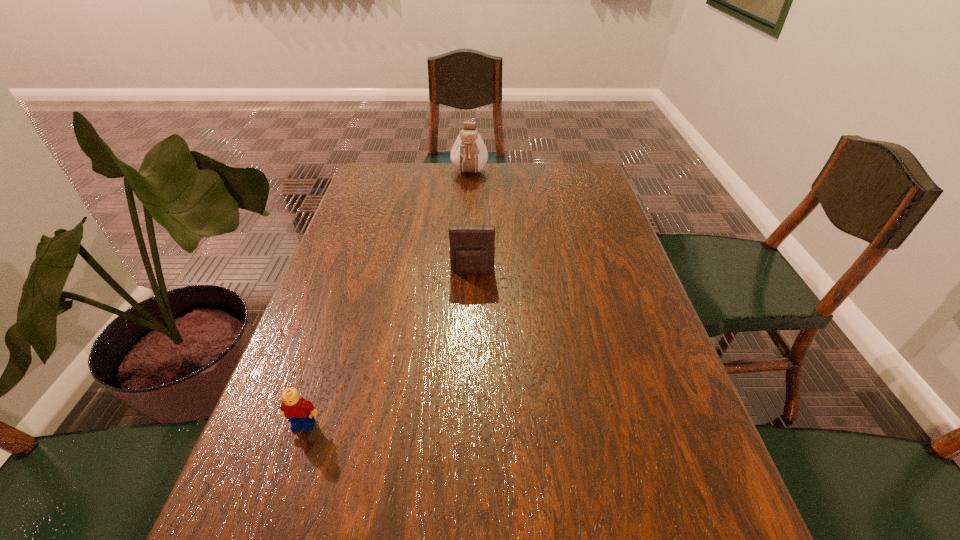
Locate an element on the screen. The height and width of the screenshot is (540, 960). vacant space at the far edge of the desktop is located at coordinates pos(491,179).

In the image, there is a desktop. In order to click on free space at the left edge in this screenshot , I will do `click(359, 293)`.

I want to click on vacant area at the right edge of the desktop, so click(592, 267).

Find the location of a particular element. The width and height of the screenshot is (960, 540). blank space at the far left corner of the desktop is located at coordinates (388, 182).

Image resolution: width=960 pixels, height=540 pixels. Identify the location of free space between the Lego and the farthest object. (387, 299).

Locate an element on the screen. This screenshot has width=960, height=540. vacant area that lies between the Lego and the tallest object is located at coordinates (387, 299).

Where is `free space between the second farthest object and the nearest object`? free space between the second farthest object and the nearest object is located at coordinates (388, 348).

At what (x,y) coordinates should I click in order to perform the action: click on free space between the farther pouch and the Lego. Please return your answer as a coordinate pair (x, y). This screenshot has height=540, width=960. Looking at the image, I should click on (387, 299).

Where is `free space between the second tallest object and the nearest object`? This screenshot has height=540, width=960. free space between the second tallest object and the nearest object is located at coordinates (388, 348).

Locate an element on the screen. Image resolution: width=960 pixels, height=540 pixels. free space between the Lego and the farther pouch is located at coordinates (387, 299).